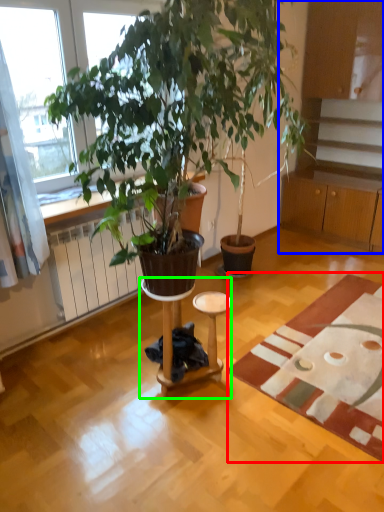
Question: Based on their relative distances, which object is farther from mat (highlighted by a red box)? Choose from cabinetry (highlighted by a blue box) and side table (highlighted by a green box).

Choices:
 (A) cabinetry
 (B) side table

Answer: (A)